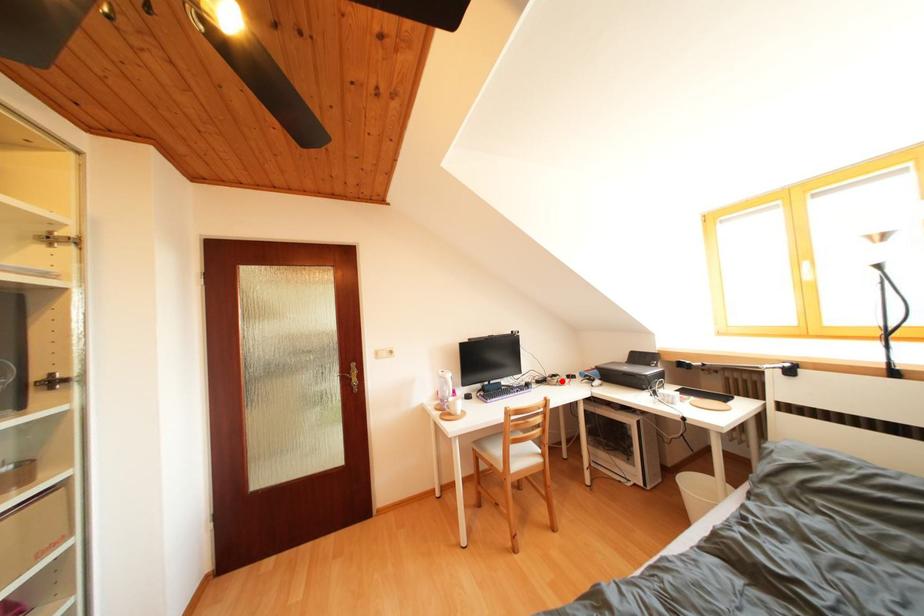
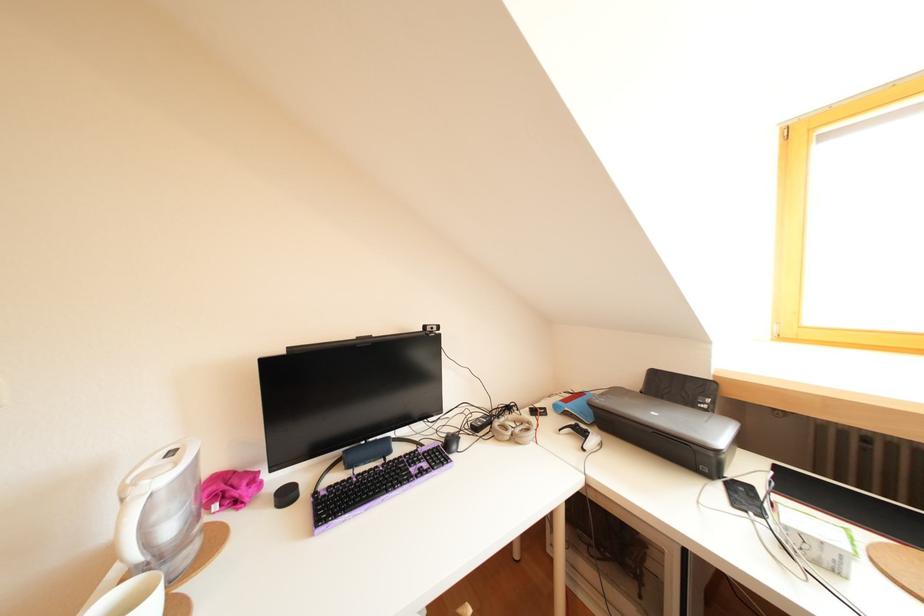
Question: I am providing you with two images of the same scene from different viewpoints. A red point is marked on the first image. Can you still see the location of the red point in image 2?

Choices:
 (A) Yes
 (B) No

Answer: (A)